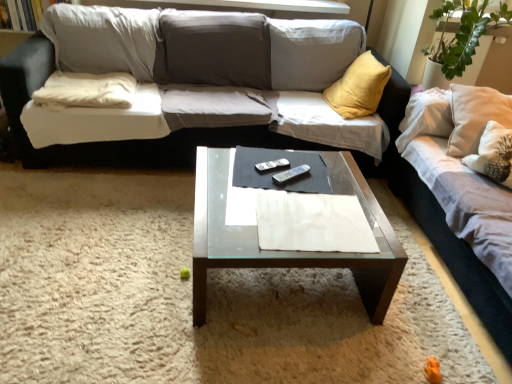
Locate an element on the screen. vacant area on top of transparent glass coffee table at center (from a real-world perspective) is located at coordinates (281, 172).